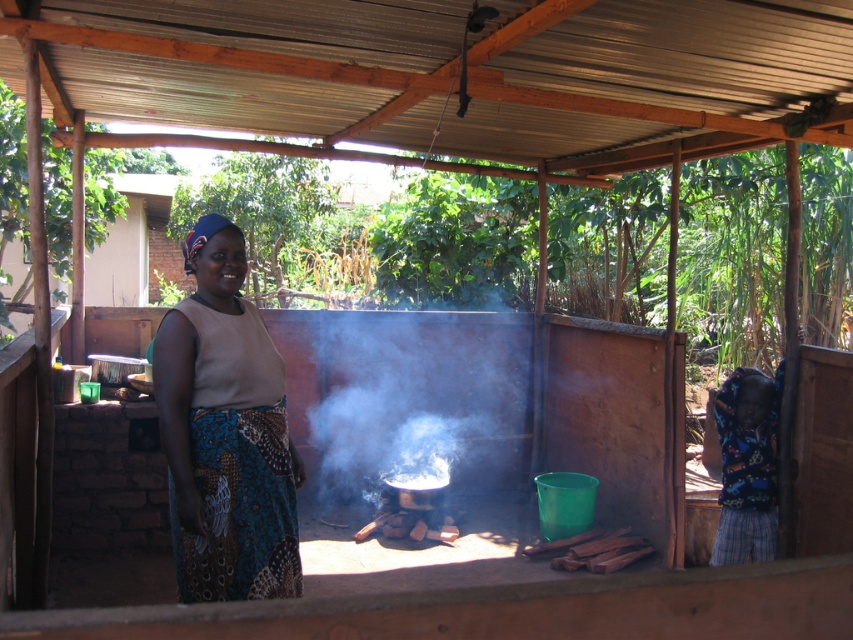
You are a photographer capturing the scene. You notice the printed fabric skirt at center and the white smoke at center. Which object takes up more visual space in the image?

The white smoke at center takes up more visual space than the printed fabric skirt at center.

You are standing at the entrance of the outdoor cooking area and want to walk to the point marked as point (x=490, y=346). There is an obstacle at point (x=206, y=540). Will you encounter the obstacle before reaching your destination?

Yes, because point (x=206, y=540) is in front of point (x=490, y=346), so you will encounter the obstacle at point (x=206, y=540) before reaching your destination.